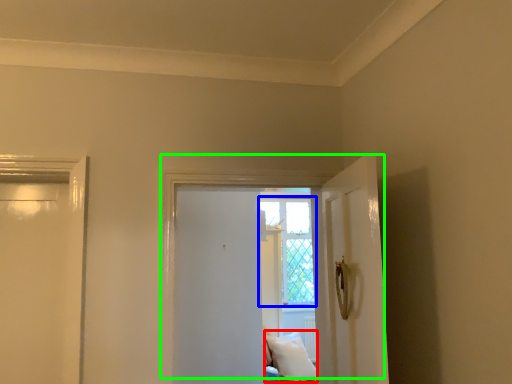
Question: Considering the real-world distances, which object is closest to pillow (highlighted by a red box)? window (highlighted by a blue box) or door (highlighted by a green box).

Choices:
 (A) window
 (B) door

Answer: (A)